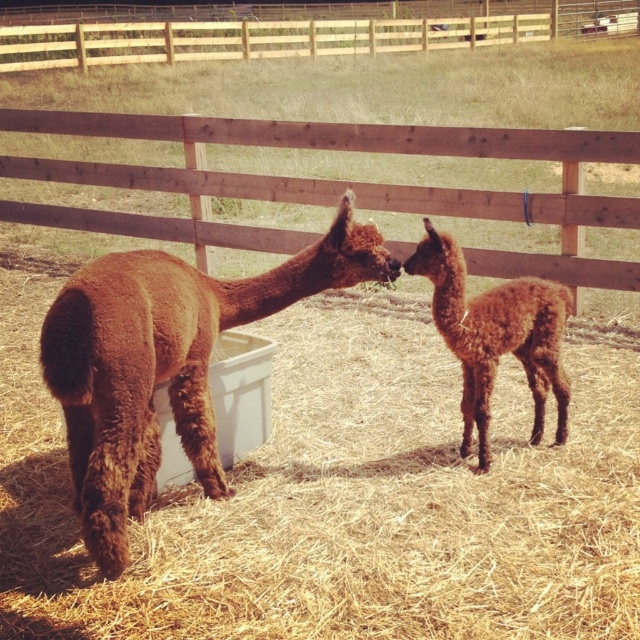
Question: Which of the following is the farthest from the observer?

Choices:
 (A) (552, 292)
 (B) (182, 435)

Answer: (A)

Question: Does brown woolen alpaca at center appear on the right side of brown fuzzy alpaca at center?

Choices:
 (A) no
 (B) yes

Answer: (A)

Question: Does brown woolen alpaca at center have a larger size compared to brown fuzzy alpaca at center?

Choices:
 (A) yes
 (B) no

Answer: (A)

Question: Does brown woolen alpaca at center appear under brown fuzzy alpaca at center?

Choices:
 (A) no
 (B) yes

Answer: (B)